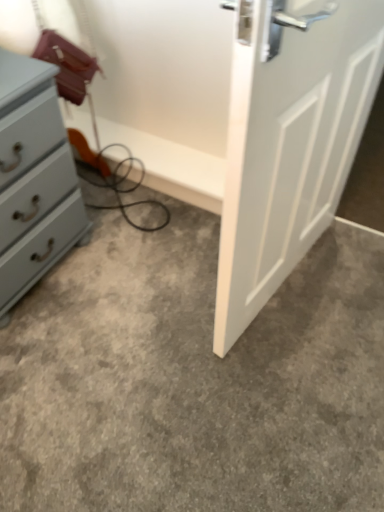
What do you see at coordinates (194, 379) in the screenshot? Image resolution: width=384 pixels, height=512 pixels. I see `gray carpet at center` at bounding box center [194, 379].

Find the location of a particular element. gray carpet at center is located at coordinates (194, 379).

You are a GUI agent. You are given a task and a screenshot of the screen. Output one action in this format:
    pyautogui.click(x=<x>, y=<y>)
    Task: Click on the matte gray chest of drawers at left
    
    Given the screenshot: What is the action you would take?
    pyautogui.click(x=33, y=178)

What do you see at coordinates (33, 178) in the screenshot?
I see `matte gray chest of drawers at left` at bounding box center [33, 178].

Identify the location of gray carpet at center. The height and width of the screenshot is (512, 384). (194, 379).

Is gray carpet at center at the left side of matte gray chest of drawers at left?

In fact, gray carpet at center is to the right of matte gray chest of drawers at left.

Does gray carpet at center come in front of matte gray chest of drawers at left?

That is True.

Is point (195, 271) more distant than point (54, 131)?

Yes, point (195, 271) is farther from viewer.

From the image's perspective, is gray carpet at center below matte gray chest of drawers at left?

Correct, gray carpet at center appears lower than matte gray chest of drawers at left in the image.

From a real-world perspective, which object rests below the other?

In real-world perspective, gray carpet at center is lower.

Which object is wider, gray carpet at center or matte gray chest of drawers at left?

gray carpet at center is wider.

From their relative heights in the image, would you say gray carpet at center is taller or shorter than matte gray chest of drawers at left?

Clearly, gray carpet at center is shorter compared to matte gray chest of drawers at left.

Who is bigger, gray carpet at center or matte gray chest of drawers at left?

matte gray chest of drawers at left is bigger.

Is gray carpet at center positioned beyond the bounds of matte gray chest of drawers at left?

gray carpet at center lies outside matte gray chest of drawers at left's area.

Is gray carpet at center not near matte gray chest of drawers at left?

gray carpet at center is near matte gray chest of drawers at left, not far away.

Looking at this image, could you tell me if gray carpet at center is turned towards matte gray chest of drawers at left?

No, gray carpet at center is not turned towards matte gray chest of drawers at left.

What's the angular difference between gray carpet at center and matte gray chest of drawers at left's facing directions?

89.4 degrees.

Locate an element on the screen. The width and height of the screenshot is (384, 512). chest of drawers behind the gray carpet at center is located at coordinates (33, 178).

Considering the positions of objects matte gray chest of drawers at left and gray carpet at center in the image provided, who is more to the left, matte gray chest of drawers at left or gray carpet at center?

matte gray chest of drawers at left is more to the left.

Is matte gray chest of drawers at left in front of gray carpet at center?

No.

Considering the points (68, 238) and (301, 267), which point is in front, point (68, 238) or point (301, 267)?

The point (68, 238) is in front.

From the image's perspective, which one is positioned lower, matte gray chest of drawers at left or gray carpet at center?

gray carpet at center appears lower in the image.

From a real-world perspective, is matte gray chest of drawers at left over gray carpet at center?

Yes, from a real-world perspective, matte gray chest of drawers at left is over gray carpet at center

Which of these two, matte gray chest of drawers at left or gray carpet at center, is wider?

Wider between the two is gray carpet at center.

Considering the relative sizes of matte gray chest of drawers at left and gray carpet at center in the image provided, is matte gray chest of drawers at left taller than gray carpet at center?

Correct, matte gray chest of drawers at left is much taller as gray carpet at center.

Does matte gray chest of drawers at left have a larger size compared to gray carpet at center?

Indeed, matte gray chest of drawers at left has a larger size compared to gray carpet at center.

Is matte gray chest of drawers at left surrounding gray carpet at center?

No, gray carpet at center is not surrounded by matte gray chest of drawers at left.

Is matte gray chest of drawers at left positioned far away from gray carpet at center?

matte gray chest of drawers at left is actually quite close to gray carpet at center.

Is matte gray chest of drawers at left facing away from gray carpet at center?

matte gray chest of drawers at left is not turned away from gray carpet at center.

You are a GUI agent. You are given a task and a screenshot of the screen. Output one action in this format:
    pyautogui.click(x=<x>, y=<y>)
    Task: Click on the concrete below the matte gray chest of drawers at left (from a real-world perspective)
    The image size is (384, 512).
    Given the screenshot: What is the action you would take?
    pyautogui.click(x=194, y=379)

There is a gray carpet at center. What are the coordinates of `the chest of drawers above it (from a real-world perspective)` in the screenshot? It's located at (33, 178).

You are a GUI agent. You are given a task and a screenshot of the screen. Output one action in this format:
    pyautogui.click(x=<x>, y=<y>)
    Task: Click on the chest of drawers behind the gray carpet at center
    
    Given the screenshot: What is the action you would take?
    pyautogui.click(x=33, y=178)